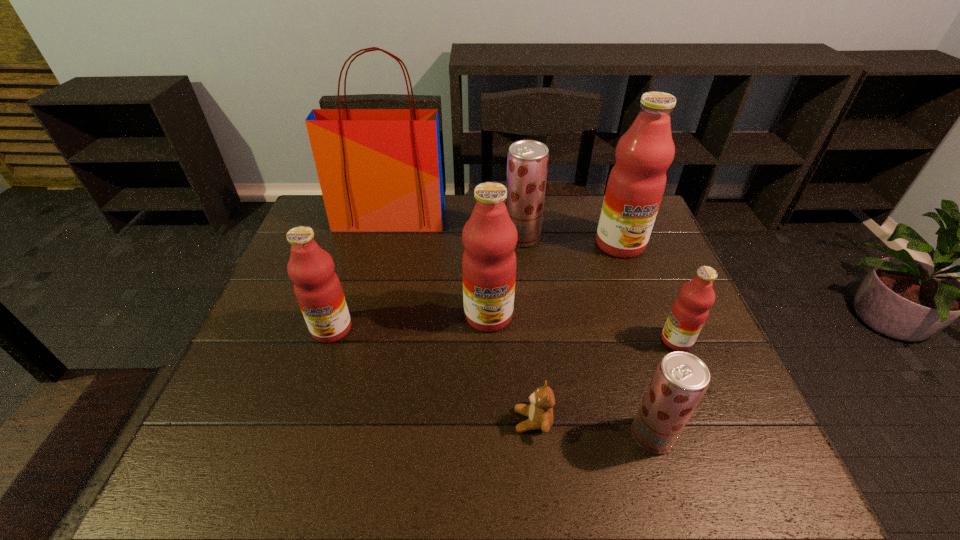
Identify the location of the nearest fruit juice. The height and width of the screenshot is (540, 960). (681, 379).

Where is `the right strawberry fruit juice`? Image resolution: width=960 pixels, height=540 pixels. the right strawberry fruit juice is located at coordinates (681, 379).

Find the location of a particular element. the shortest object is located at coordinates (540, 415).

Where is `vacant space situated 0.110m on the handle side of the shopping bag`? The height and width of the screenshot is (540, 960). vacant space situated 0.110m on the handle side of the shopping bag is located at coordinates (380, 255).

Where is `vacant space located on the label of the biggest pink fruit juice`? This screenshot has width=960, height=540. vacant space located on the label of the biggest pink fruit juice is located at coordinates (636, 289).

Find the location of a particular element. This screenshot has width=960, height=540. vacant space situated 0.210m on the label of the fifth shortest fruit juice is located at coordinates (491, 411).

Where is `vacant space situated on the left of the bigger strawberry fruit juice`? vacant space situated on the left of the bigger strawberry fruit juice is located at coordinates (385, 238).

Locate an element on the screen. vacant space located 0.330m on the label of the second smallest pink fruit juice is located at coordinates (282, 484).

Where is `free space located 0.280m on the label of the smallest pink fruit juice`? The width and height of the screenshot is (960, 540). free space located 0.280m on the label of the smallest pink fruit juice is located at coordinates (546, 340).

Locate an element on the screen. free spot located 0.210m on the label of the smallest pink fruit juice is located at coordinates (575, 340).